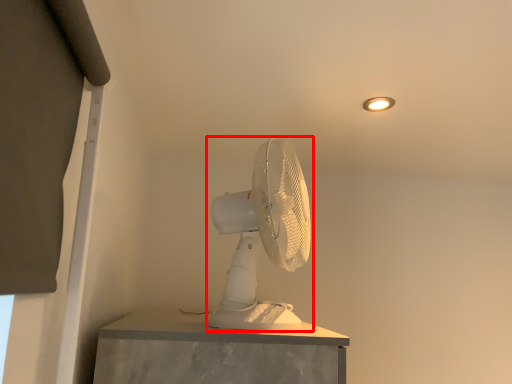
Question: From the image's perspective, where is mechanical fan (annotated by the red box) located in relation to light fixture in the image?

Choices:
 (A) above
 (B) below

Answer: (B)